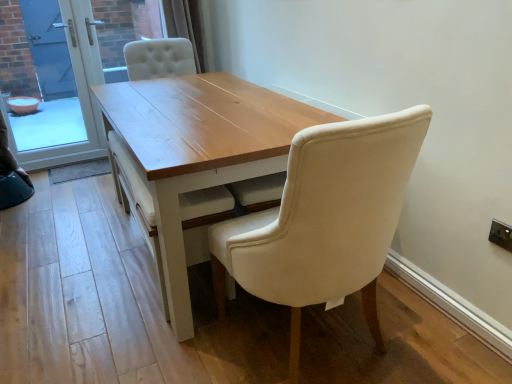
Describe the element at coordinates (325, 220) in the screenshot. This screenshot has width=512, height=384. I see `matte cream chair at center` at that location.

Where is `white plastic electric outlet at upper right`? white plastic electric outlet at upper right is located at coordinates 501,235.

Measure the distance between white plastic electric outlet at upper right and camera.

white plastic electric outlet at upper right is 1.46 meters away from camera.

What is the approximate width of tufted fabric curtain at upper center?

The width of tufted fabric curtain at upper center is 12.93 inches.

At what (x,y) coordinates should I click in order to perform the action: click on tufted fabric curtain at upper center. Please return your answer as a coordinate pair (x, y). The height and width of the screenshot is (384, 512). Looking at the image, I should click on (187, 27).

Identify the location of light wood table at center. Image resolution: width=512 pixels, height=384 pixels. (200, 149).

Can you confirm if tufted fabric curtain at upper center is positioned to the left of light wood table at center?

Yes, tufted fabric curtain at upper center is to the left of light wood table at center.

Can light wood table at center be found inside tufted fabric curtain at upper center?

Actually, light wood table at center is outside tufted fabric curtain at upper center.

Based on the photo, between tufted fabric curtain at upper center and light wood table at center, which one has more height?

light wood table at center.

Is the surface of tufted fabric curtain at upper center in direct contact with light wood table at center?

tufted fabric curtain at upper center and light wood table at center are clearly separated.

Could you tell me if blue glass screen door at left, arranged as the first screen door when viewed from the left, is facing light wood table at center?

Yes, blue glass screen door at left, arranged as the first screen door when viewed from the left, is turned towards light wood table at center.

Can you see blue glass screen door at left, arranged as the first screen door when viewed from the left, touching light wood table at center?

There is a gap between blue glass screen door at left, arranged as the first screen door when viewed from the left, and light wood table at center.

From a real-world perspective, relative to light wood table at center, is blue glass screen door at left, arranged as the first screen door when viewed from the left, vertically above or below?

Clearly, from a real-world perspective, blue glass screen door at left, arranged as the first screen door when viewed from the left, is above light wood table at center.

Based on the photo, would you say transparent glass screen door at upper left, which is the first screen door from right to left, is part of light wood table at center's contents?

No.

How distant is light wood table at center from transparent glass screen door at upper left, arranged as the second screen door when viewed from the left?

5.02 feet.

Locate an element on the screen. table below the transparent glass screen door at upper left, which is the first screen door from right to left (from the image's perspective) is located at coordinates (200, 149).

Which is more distant, (214, 168) or (39, 133)?

Positioned behind is point (39, 133).

Can you confirm if blue glass screen door at left, which is the 2th screen door from right to left, is bigger than matte cream chair at center?

Incorrect, blue glass screen door at left, which is the 2th screen door from right to left, is not larger than matte cream chair at center.

Is matte cream chair at center at the back of blue glass screen door at left, which is the 2th screen door from right to left?

blue glass screen door at left, which is the 2th screen door from right to left, does not have its back to matte cream chair at center.

In terms of height, does blue glass screen door at left, which is the 2th screen door from right to left, look taller or shorter compared to matte cream chair at center?

Considering their sizes, blue glass screen door at left, which is the 2th screen door from right to left, has more height than matte cream chair at center.

Which object is closer to the camera, blue glass screen door at left, which is the 2th screen door from right to left, or matte cream chair at center?

matte cream chair at center is in front.

From a real-world perspective, between transparent glass screen door at upper left, which is the first screen door from right to left, and light wood table at center, who is vertically higher?

transparent glass screen door at upper left, which is the first screen door from right to left, from a real-world perspective.

Considering the relative sizes of transparent glass screen door at upper left, arranged as the second screen door when viewed from the left, and light wood table at center in the image provided, is transparent glass screen door at upper left, arranged as the second screen door when viewed from the left, smaller than light wood table at center?

Correct, transparent glass screen door at upper left, arranged as the second screen door when viewed from the left, occupies less space than light wood table at center.

Is transparent glass screen door at upper left, arranged as the second screen door when viewed from the left, turned away from light wood table at center?

No, transparent glass screen door at upper left, arranged as the second screen door when viewed from the left,'s orientation is not away from light wood table at center.

Which object is closer to the camera, matte cream chair at center or blue glass screen door at left, arranged as the first screen door when viewed from the left?

matte cream chair at center is in front.

Considering the relative sizes of matte cream chair at center and blue glass screen door at left, which is the 2th screen door from right to left, in the image provided, is matte cream chair at center wider than blue glass screen door at left, which is the 2th screen door from right to left,?

Yes.

Does point (356, 136) appear closer or farther from the camera than point (96, 62)?

Point (356, 136) is positioned closer to the camera compared to point (96, 62).

Could you tell me if matte cream chair at center is facing blue glass screen door at left, which is the 2th screen door from right to left?

Yes.

Does tufted fabric curtain at upper center have a lesser width compared to white plastic electric outlet at upper right?

Incorrect, the width of tufted fabric curtain at upper center is not less than that of white plastic electric outlet at upper right.

Is tufted fabric curtain at upper center aimed at white plastic electric outlet at upper right?

Yes, tufted fabric curtain at upper center is oriented towards white plastic electric outlet at upper right.

The width and height of the screenshot is (512, 384). In order to click on curtain that is on the left side of white plastic electric outlet at upper right in this screenshot , I will do `click(187, 27)`.

Where is `table below the tufted fabric curtain at upper center (from a real-world perspective)`? The width and height of the screenshot is (512, 384). table below the tufted fabric curtain at upper center (from a real-world perspective) is located at coordinates (x=200, y=149).

This screenshot has width=512, height=384. In order to click on the 1st screen door positioned above the light wood table at center (from the image's perspective) in this screenshot , I will do `click(52, 83)`.

From the image, which object appears to be nearer to blue glass screen door at left, arranged as the first screen door when viewed from the left, light wood table at center or matte cream chair at center?

Among the two, light wood table at center is located nearer to blue glass screen door at left, arranged as the first screen door when viewed from the left.

Looking at the image, which one is located further to tufted fabric curtain at upper center, light wood table at center or white plastic electric outlet at upper right?

white plastic electric outlet at upper right is further to tufted fabric curtain at upper center.

When comparing their distances from matte cream chair at center, does white plastic electric outlet at upper right or blue glass screen door at left, arranged as the first screen door when viewed from the left, seem further?

→ blue glass screen door at left, arranged as the first screen door when viewed from the left, is further to matte cream chair at center.

In the scene shown: Considering their positions, is tufted fabric curtain at upper center positioned further to light wood table at center than blue glass screen door at left, which is the 2th screen door from right to left?

The object further to light wood table at center is blue glass screen door at left, which is the 2th screen door from right to left.

Which object lies nearer to the anchor point white plastic electric outlet at upper right, light wood table at center or transparent glass screen door at upper left, which is the first screen door from right to left?

light wood table at center lies closer to white plastic electric outlet at upper right than the other object.

When comparing their distances from light wood table at center, does transparent glass screen door at upper left, which is the first screen door from right to left, or blue glass screen door at left, which is the 2th screen door from right to left, seem further?

Among the two, transparent glass screen door at upper left, which is the first screen door from right to left, is located further to light wood table at center.

When comparing their distances from white plastic electric outlet at upper right, does tufted fabric curtain at upper center or transparent glass screen door at upper left, arranged as the second screen door when viewed from the left, seem further?

transparent glass screen door at upper left, arranged as the second screen door when viewed from the left, is further to white plastic electric outlet at upper right.

Looking at the image, which one is located further to matte cream chair at center, transparent glass screen door at upper left, which is the first screen door from right to left, or blue glass screen door at left, arranged as the first screen door when viewed from the left?

blue glass screen door at left, arranged as the first screen door when viewed from the left.

At what (x,y) coordinates should I click in order to perform the action: click on table between blue glass screen door at left, which is the 2th screen door from right to left, and white plastic electric outlet at upper right, in the horizontal direction. Please return your answer as a coordinate pair (x, y). Looking at the image, I should click on (200, 149).

Image resolution: width=512 pixels, height=384 pixels. In order to click on table located between matte cream chair at center and tufted fabric curtain at upper center in the depth direction in this screenshot , I will do [200, 149].

Identify the location of chair situated between transparent glass screen door at upper left, which is the first screen door from right to left, and white plastic electric outlet at upper right from left to right. This screenshot has height=384, width=512. (325, 220).

Where is `table between matte cream chair at center and blue glass screen door at left, which is the 2th screen door from right to left, from front to back`? The width and height of the screenshot is (512, 384). table between matte cream chair at center and blue glass screen door at left, which is the 2th screen door from right to left, from front to back is located at coordinates point(200,149).